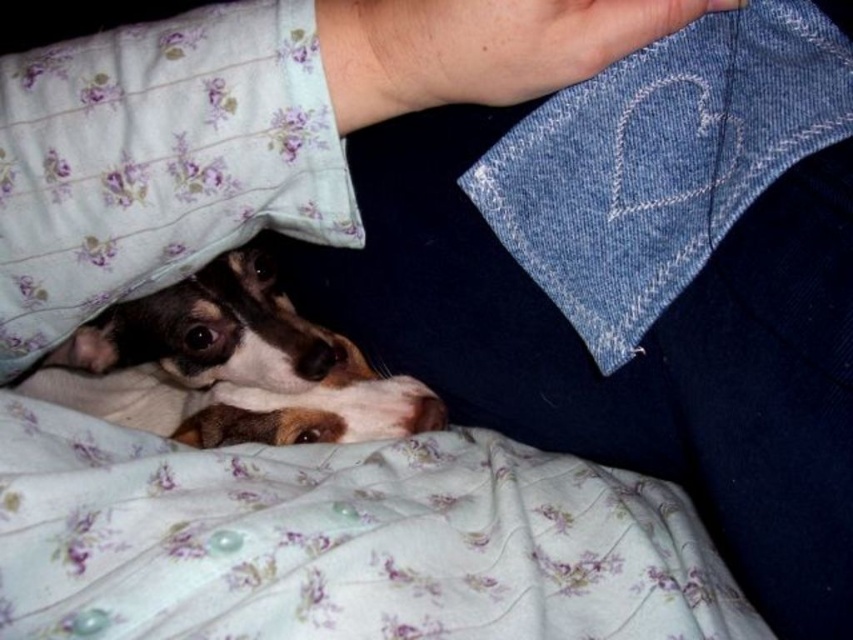
From the picture: Can you confirm if fluffy white blanket at lower left is positioned to the right of fluffy white pillow at upper left?

Indeed, fluffy white blanket at lower left is positioned on the right side of fluffy white pillow at upper left.

Does fluffy white blanket at lower left appear over fluffy white pillow at upper left?

Incorrect, fluffy white blanket at lower left is not positioned above fluffy white pillow at upper left.

Who is more forward, (x=144, y=634) or (x=158, y=131)?

Positioned in front is point (x=144, y=634).

I want to click on fluffy white blanket at lower left, so click(x=341, y=540).

Can you confirm if fluffy white blanket at lower left is smaller than denim at upper center?

Incorrect, fluffy white blanket at lower left is not smaller in size than denim at upper center.

Between point (160, 604) and point (608, 276), which one is positioned behind?

The point (608, 276) is more distant.

Does point (244, 582) lie behind point (577, 264)?

No.

Locate an element on the screen. This screenshot has height=640, width=853. fluffy white blanket at lower left is located at coordinates (341, 540).

Where is `denim at upper center`? This screenshot has width=853, height=640. denim at upper center is located at coordinates (660, 163).

I want to click on denim at upper center, so click(x=660, y=163).

Locate an element on the screen. denim at upper center is located at coordinates (660, 163).